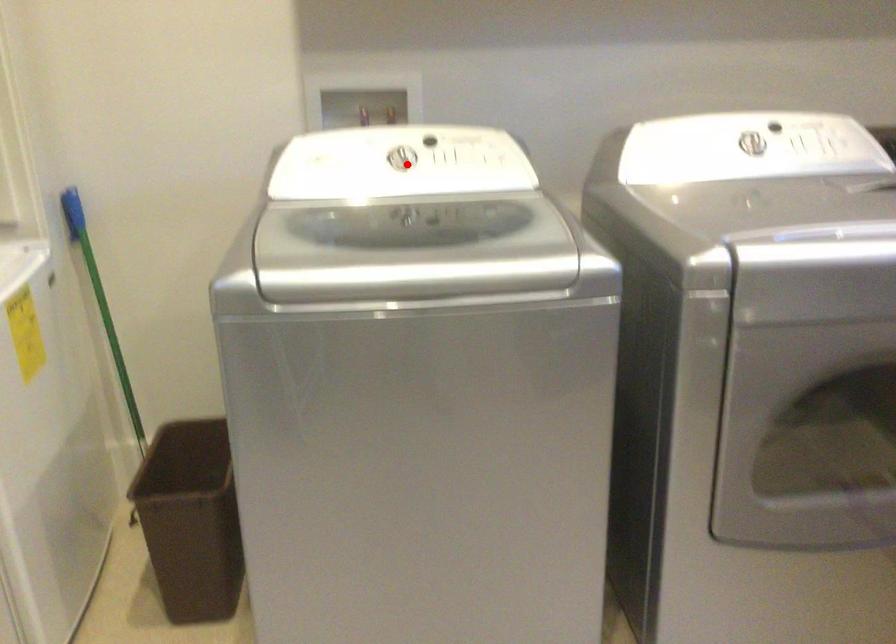
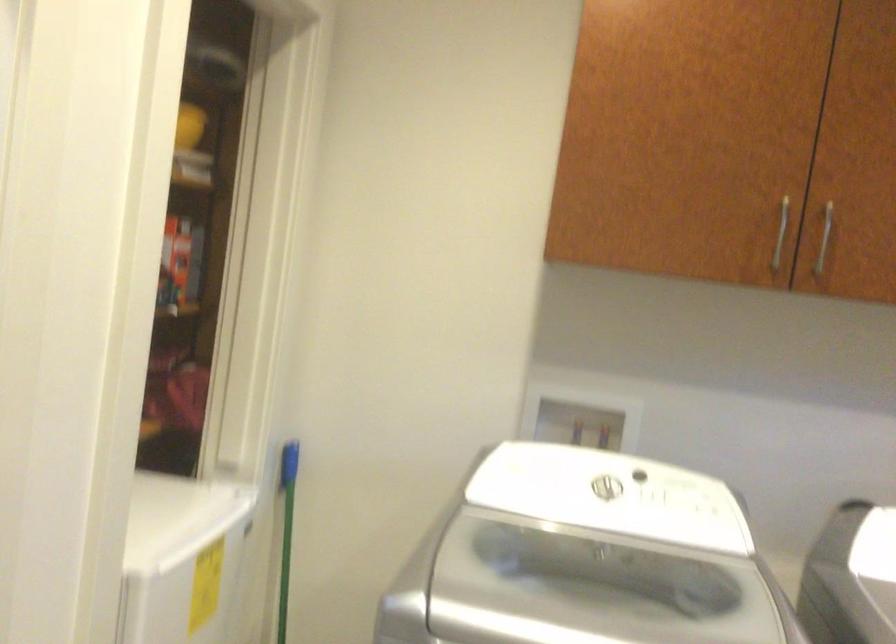
In the second image, find the point that corresponds to the highlighted location in the first image.

(609, 495)